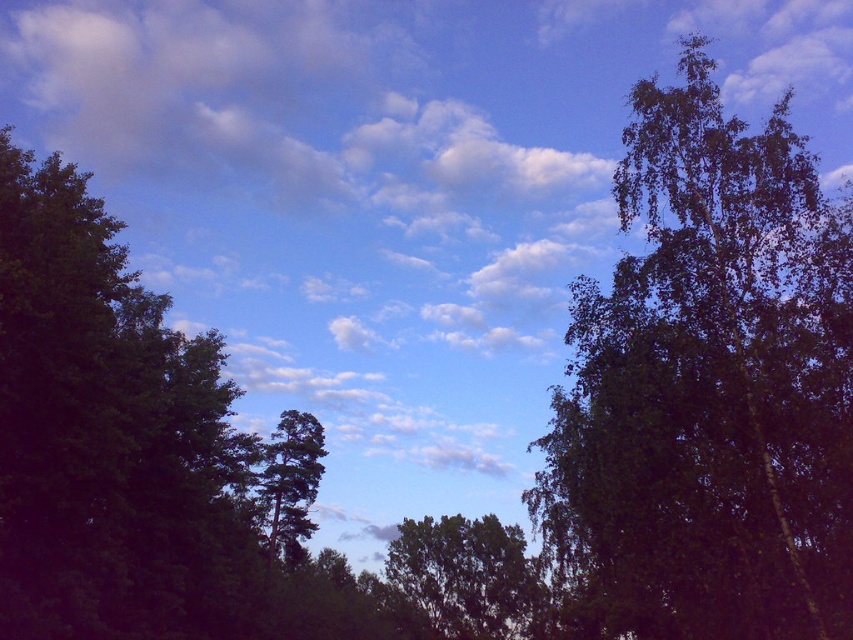
Question: Which object appears closest to the camera in this image?

Choices:
 (A) green matte tree at center
 (B) green leafy tree at center
 (C) green leafy tree at right

Answer: (C)

Question: Estimate the real-world distances between objects in this image. Which object is closer to the green leafy tree at center?

Choices:
 (A) green matte tree at center
 (B) green leafy tree at right

Answer: (A)

Question: Can you confirm if green leafy tree at right is smaller than green leafy tree at center?

Choices:
 (A) yes
 (B) no

Answer: (B)

Question: Estimate the real-world distances between objects in this image. Which object is farther from the green leafy tree at right?

Choices:
 (A) green leafy tree at center
 (B) green matte tree at center

Answer: (A)

Question: Does green leafy tree at right appear on the right side of green leafy tree at center?

Choices:
 (A) no
 (B) yes

Answer: (B)

Question: Can you confirm if green leafy tree at right is thinner than green matte tree at center?

Choices:
 (A) yes
 (B) no

Answer: (B)